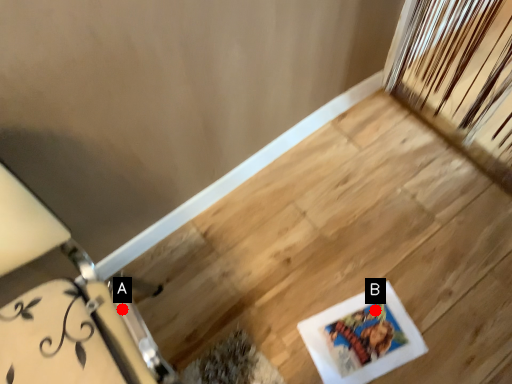
Question: Two points are circled on the image, labeled by A and B beside each circle. Which point appears closest to the camera in this image?

Choices:
 (A) A is closer
 (B) B is closer

Answer: (A)